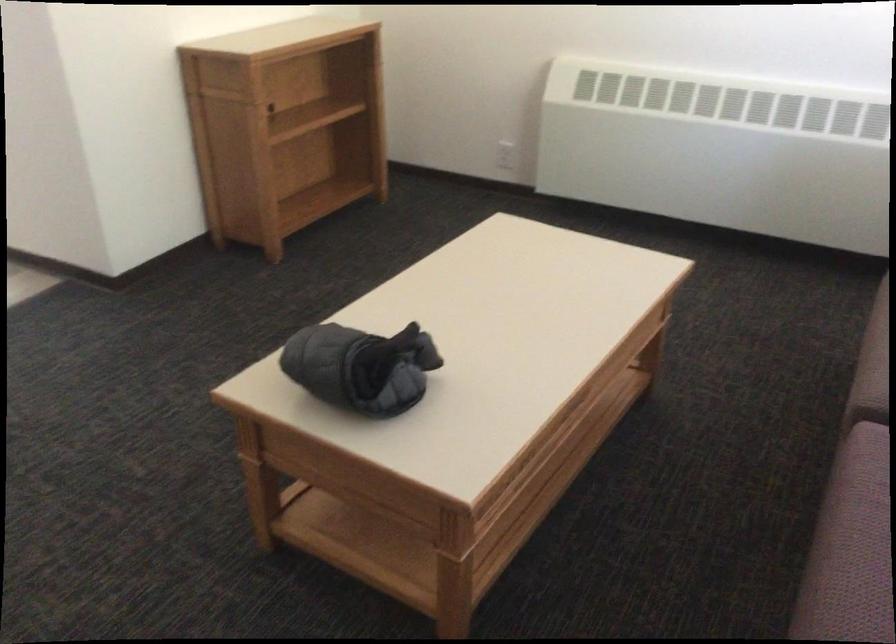
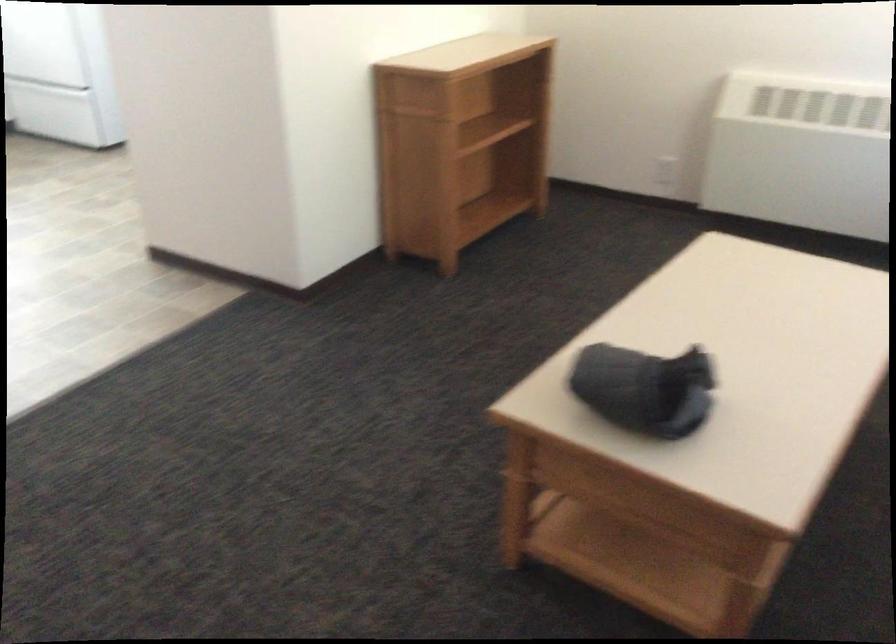
In the second image, find the point that corresponds to the point at 350,366 in the first image.

(644, 389)